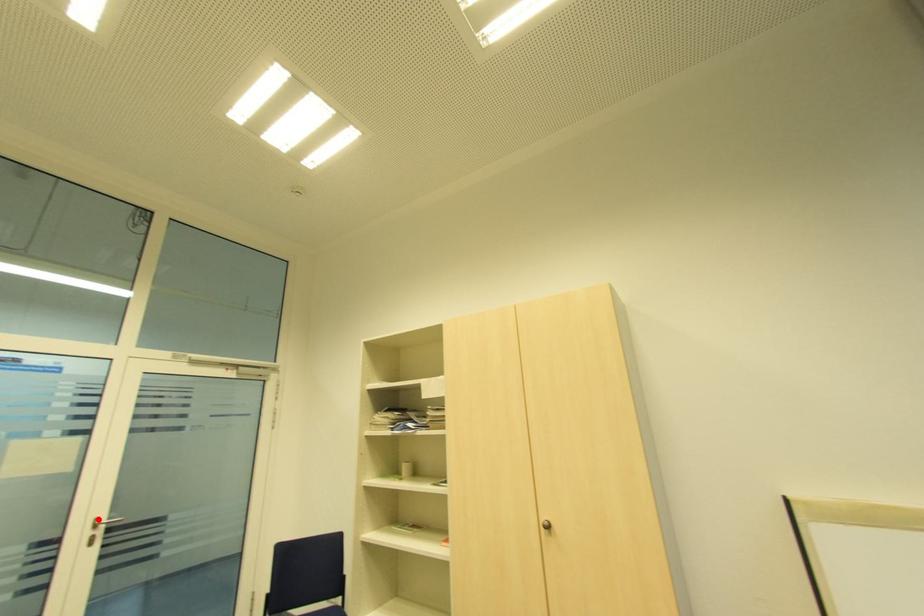
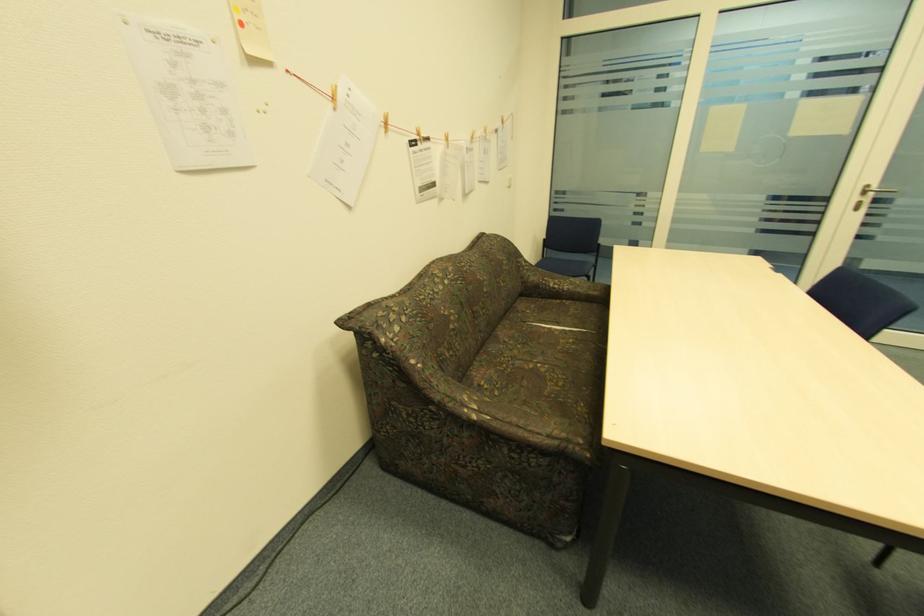
Find the pixel in the second image that matches the highlighted location in the first image.

(870, 187)